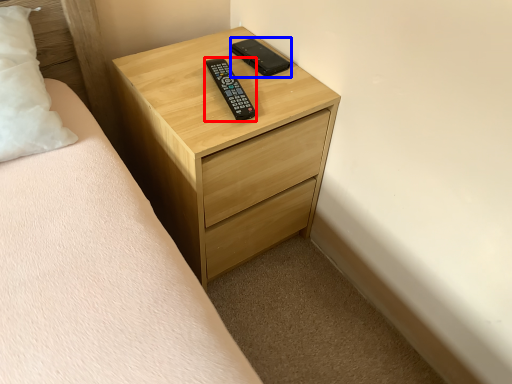
Question: Which of the following is the farthest to the observer, control (highlighted by a red box) or control (highlighted by a blue box)?

Choices:
 (A) control
 (B) control

Answer: (B)